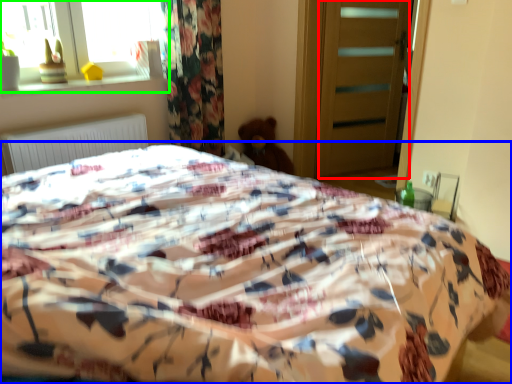
Question: Which is nearer to the screen door (highlighted by a red box)? bed (highlighted by a blue box) or window (highlighted by a green box).

Choices:
 (A) bed
 (B) window

Answer: (B)